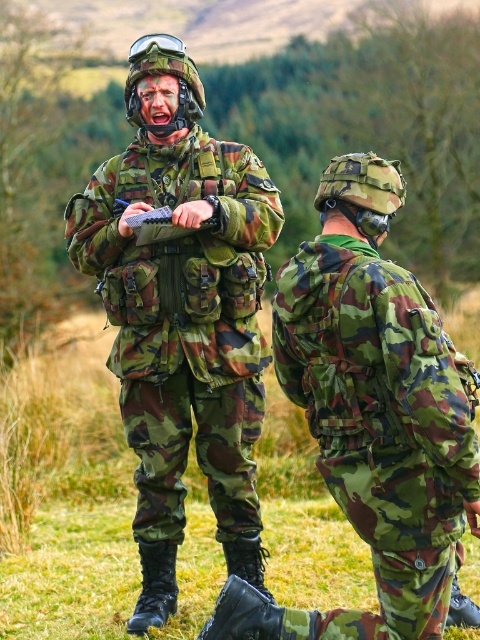
Question: Which point appears closest to the camera in this image?

Choices:
 (A) (92, 196)
 (B) (475, 458)

Answer: (B)

Question: Does camouflage fabric uniform at center appear under camouflage fabric backpack at center?

Choices:
 (A) no
 (B) yes

Answer: (A)

Question: Does camouflage fabric uniform at center appear over camouflage fabric backpack at center?

Choices:
 (A) yes
 (B) no

Answer: (A)

Question: Which object is closer to the camera taking this photo?

Choices:
 (A) camouflage fabric uniform at center
 (B) camouflage fabric backpack at center

Answer: (B)

Question: Is the position of camouflage fabric uniform at center more distant than that of camouflage fabric backpack at center?

Choices:
 (A) no
 (B) yes

Answer: (B)